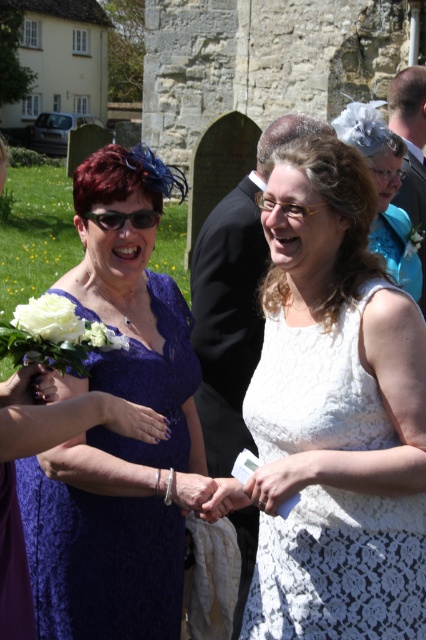
Question: Which of the following is the closest to the observer?

Choices:
 (A) black satin suit at center
 (B) lace dress at center
 (C) white lace flower at center
 (D) white lace dress at center

Answer: (D)

Question: Which of these objects is positioned closest to the white lace dress at center?

Choices:
 (A) white matte rose at lower left
 (B) black satin suit at center
 (C) white fabric bouquet at lower left
 (D) white lace flower at center

Answer: (B)

Question: Which of the following is the farthest from the observer?

Choices:
 (A) white lace flower at center
 (B) white fabric bouquet at lower left
 (C) black satin suit at center
 (D) lace dress at center

Answer: (A)

Question: Can you confirm if black satin suit at center is positioned below white fabric bouquet at lower left?

Choices:
 (A) no
 (B) yes

Answer: (B)

Question: Does black satin suit at center appear under white matte rose at lower left?

Choices:
 (A) yes
 (B) no

Answer: (A)

Question: From the image, what is the correct spatial relationship of white lace dress at center in relation to white matte rose at lower left?

Choices:
 (A) right
 (B) left

Answer: (A)